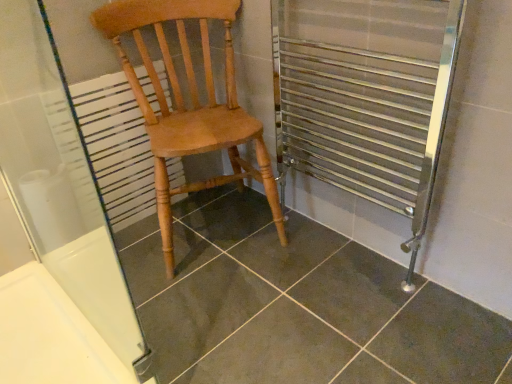
What do you see at coordinates (116, 147) in the screenshot? The image size is (512, 384). I see `white textured radiator at left` at bounding box center [116, 147].

Locate an element on the screen. The image size is (512, 384). white textured radiator at left is located at coordinates (116, 147).

Does dark gray tile at center touch white textured radiator at left?

No, dark gray tile at center is not next to white textured radiator at left.

How many degrees apart are the facing directions of dark gray tile at center and white textured radiator at left?

The angular difference between dark gray tile at center and white textured radiator at left is 178 degrees.

Is dark gray tile at center not inside white textured radiator at left?

Yes.

Which is closer, (442, 340) or (147, 202)?

Point (442, 340) is closer to the camera than point (147, 202).

Is point (134, 102) behind point (271, 317)?

Yes, it is.

Is dark gray tile at center at the back of white textured radiator at left?

white textured radiator at left does not have its back to dark gray tile at center.

Consider the image. From a real-world perspective, is white textured radiator at left positioned above or below dark gray tile at center?

From a real-world perspective, white textured radiator at left is physically above dark gray tile at center.

Considering the sizes of white textured radiator at left and transparent glass screen door at upper left in the image, is white textured radiator at left bigger or smaller than transparent glass screen door at upper left?

white textured radiator at left is smaller than transparent glass screen door at upper left.

Relative to transparent glass screen door at upper left, is white textured radiator at left in front or behind?

Visually, white textured radiator at left is located behind transparent glass screen door at upper left.

Is white textured radiator at left facing away from transparent glass screen door at upper left?

No, white textured radiator at left's orientation is not away from transparent glass screen door at upper left.

Can you confirm if light brown wood chair at center is taller than transparent glass screen door at upper left?

In fact, light brown wood chair at center may be shorter than transparent glass screen door at upper left.

The height and width of the screenshot is (384, 512). Identify the location of screen door lying below the light brown wood chair at center (from the image's perspective). (59, 182).

From the image's perspective, is light brown wood chair at center located above transparent glass screen door at upper left?

Indeed, from the image's perspective, light brown wood chair at center is shown above transparent glass screen door at upper left.

Is light brown wood chair at center oriented towards transparent glass screen door at upper left?

No, light brown wood chair at center is not oriented towards transparent glass screen door at upper left.

Can you confirm if white textured radiator at left is wider than light brown wood chair at center?

No.

In the image, there is a white textured radiator at left. Where is `chair above it (from the image's perspective)`? chair above it (from the image's perspective) is located at coordinates (191, 103).

In terms of height, does white textured radiator at left look taller or shorter compared to light brown wood chair at center?

Considering their sizes, white textured radiator at left has less height than light brown wood chair at center.

Is white textured radiator at left in front of or behind light brown wood chair at center in the image?

white textured radiator at left is behind light brown wood chair at center.

Is the position of dark gray tile at center more distant than that of transparent glass screen door at upper left?

That is True.

From a real-world perspective, is dark gray tile at center below transparent glass screen door at upper left?

Yes, from a real-world perspective, dark gray tile at center is under transparent glass screen door at upper left.

How different are the orientations of dark gray tile at center and transparent glass screen door at upper left in degrees?

The angle between the facing direction of dark gray tile at center and the facing direction of transparent glass screen door at upper left is 89.5 degrees.

Can transparent glass screen door at upper left be found inside dark gray tile at center?

No, dark gray tile at center does not contain transparent glass screen door at upper left.

Is transparent glass screen door at upper left looking in the opposite direction of white textured radiator at left?

No.

Is point (78, 223) closer to viewer compared to point (137, 68)?

That is False.

Locate an element on the screen. This screenshot has height=384, width=512. screen door below the white textured radiator at left (from the image's perspective) is located at coordinates click(59, 182).

From a real-world perspective, is transparent glass screen door at upper left physically above white textured radiator at left?

Correct, in the physical world, transparent glass screen door at upper left is higher than white textured radiator at left.

Locate an element on the screen. tile in front of the white textured radiator at left is located at coordinates (296, 305).

Locate an element on the screen. radiator that is on the left side of dark gray tile at center is located at coordinates (116, 147).

From the image, which object appears to be farther from white textured radiator at left, transparent glass screen door at upper left or light brown wood chair at center?

transparent glass screen door at upper left is further to white textured radiator at left.

From the image, which object appears to be farther from light brown wood chair at center, white textured radiator at left or dark gray tile at center?

Among the two, dark gray tile at center is located further to light brown wood chair at center.

Looking at the image, which one is located further to dark gray tile at center, light brown wood chair at center or white textured radiator at left?

The object further to dark gray tile at center is white textured radiator at left.

In the scene shown: Estimate the real-world distances between objects in this image. Which object is closer to transparent glass screen door at upper left, light brown wood chair at center or white textured radiator at left?

white textured radiator at left is positioned closer to the anchor transparent glass screen door at upper left.

Based on their spatial positions, is light brown wood chair at center or transparent glass screen door at upper left further from dark gray tile at center?

Based on the image, transparent glass screen door at upper left appears to be further to dark gray tile at center.

From the image, which object appears to be nearer to light brown wood chair at center, white textured radiator at left or transparent glass screen door at upper left?

The object closer to light brown wood chair at center is white textured radiator at left.

Which object lies further to the anchor point transparent glass screen door at upper left, white textured radiator at left or light brown wood chair at center?

The object further to transparent glass screen door at upper left is light brown wood chair at center.

Based on the photo, considering their positions, is light brown wood chair at center positioned closer to transparent glass screen door at upper left than dark gray tile at center?

Based on the image, light brown wood chair at center appears to be nearer to transparent glass screen door at upper left.

Where is `screen door between light brown wood chair at center and dark gray tile at center in the vertical direction`? The image size is (512, 384). screen door between light brown wood chair at center and dark gray tile at center in the vertical direction is located at coordinates (59, 182).

You are a GUI agent. You are given a task and a screenshot of the screen. Output one action in this format:
    pyautogui.click(x=<x>, y=<y>)
    Task: Click on the tile positioned between transparent glass screen door at upper left and white textured radiator at left from near to far
    Image resolution: width=512 pixels, height=384 pixels.
    Given the screenshot: What is the action you would take?
    pyautogui.click(x=296, y=305)

Identify the location of chair positioned between dark gray tile at center and white textured radiator at left from near to far. (191, 103).

This screenshot has height=384, width=512. I want to click on chair located between transparent glass screen door at upper left and white textured radiator at left in the depth direction, so click(x=191, y=103).